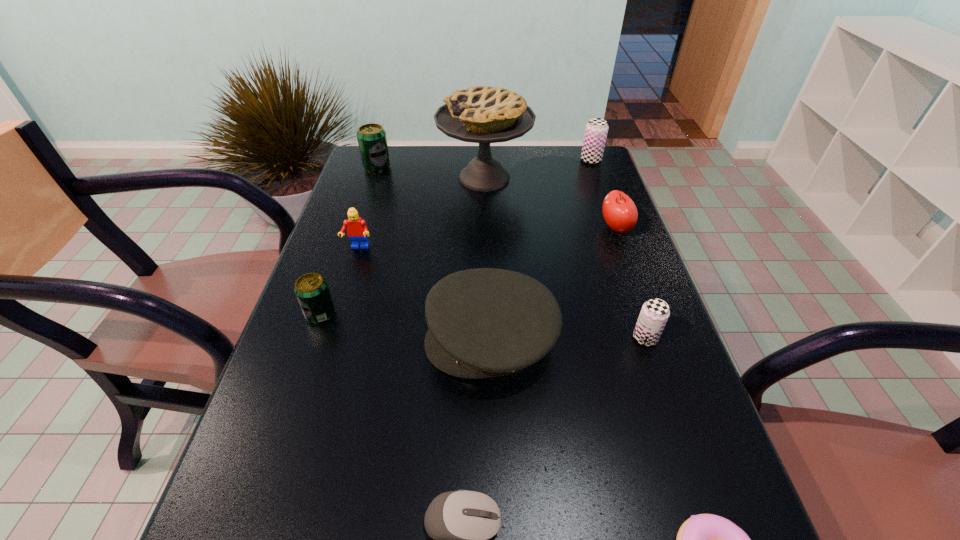
You are a GUI agent. You are given a task and a screenshot of the screen. Output one action in this format:
    pyautogui.click(x=<x>, y=<y>)
    Task: Click on the vacant space located 0.250m on the front-facing side of the red Lego
    The height and width of the screenshot is (540, 960).
    Given the screenshot: What is the action you would take?
    pyautogui.click(x=333, y=329)

This screenshot has width=960, height=540. Find the location of `vacant space situated on the left of the nearest beer can`. vacant space situated on the left of the nearest beer can is located at coordinates (585, 338).

What are the coordinates of `free space located on the back of the second nearest beer can` in the screenshot? It's located at (336, 270).

Where is `pie that is positioned at the far edge`? Image resolution: width=960 pixels, height=540 pixels. pie that is positioned at the far edge is located at coordinates (484, 115).

Where is `Lego that is at the left edge`? This screenshot has width=960, height=540. Lego that is at the left edge is located at coordinates (357, 230).

You are a GUI agent. You are given a task and a screenshot of the screen. Output one action in this format:
    pyautogui.click(x=<x>, y=<y>)
    Task: Click on the apple present at the right edge
    The height and width of the screenshot is (540, 960).
    Given the screenshot: What is the action you would take?
    click(x=619, y=211)

Locate an element on the screen. The width and height of the screenshot is (960, 540). object located at the far left corner is located at coordinates (372, 140).

Locate an element on the screen. The image size is (960, 540). object that is at the far right corner is located at coordinates (596, 130).

Where is `vacant space at the far edge of the desktop`? vacant space at the far edge of the desktop is located at coordinates pos(542,161).

Identify the location of free space at the left edge of the desktop. (373, 250).